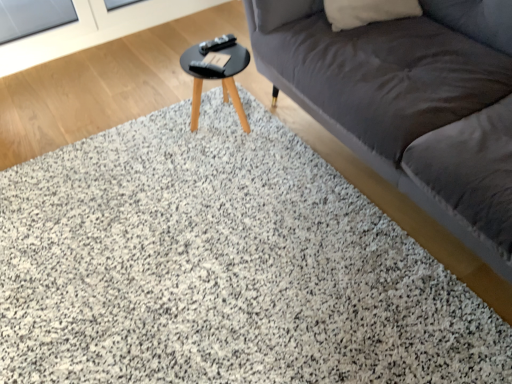
Question: Looking at the image, does black glossy table at center seem bigger or smaller compared to transparent glass screen door at upper left?

Choices:
 (A) big
 (B) small

Answer: (B)

Question: Considering the positions of black glossy table at center and transparent glass screen door at upper left in the image, is black glossy table at center wider or thinner than transparent glass screen door at upper left?

Choices:
 (A) wide
 (B) thin

Answer: (A)

Question: Considering the real-world distances, which object is farthest from the white soft pillow at upper right?

Choices:
 (A) black glossy table at center
 (B) dark gray fabric couch at upper right
 (C) transparent glass screen door at upper left

Answer: (C)

Question: Which object is the closest to the dark gray fabric couch at upper right?

Choices:
 (A) white soft pillow at upper right
 (B) transparent glass screen door at upper left
 (C) black glossy table at center

Answer: (A)